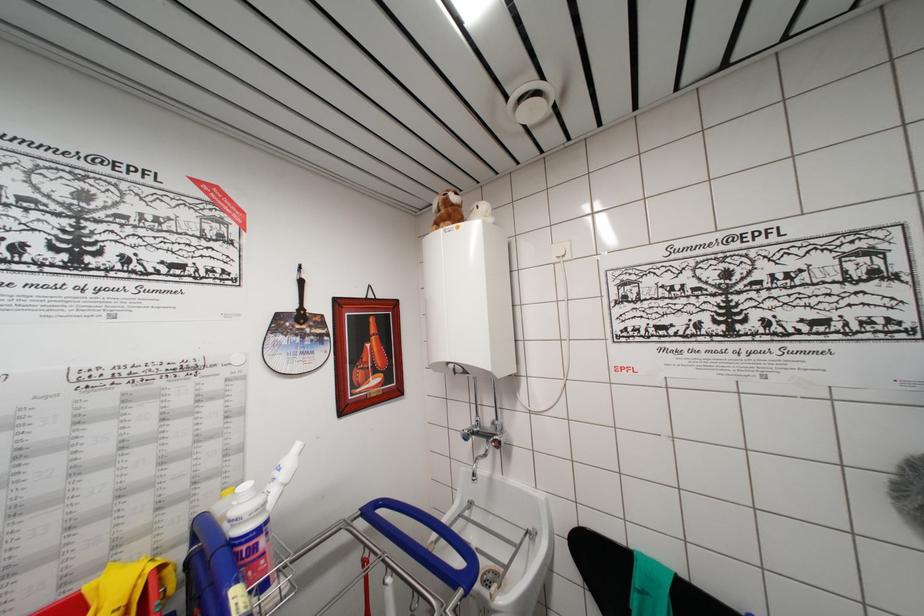
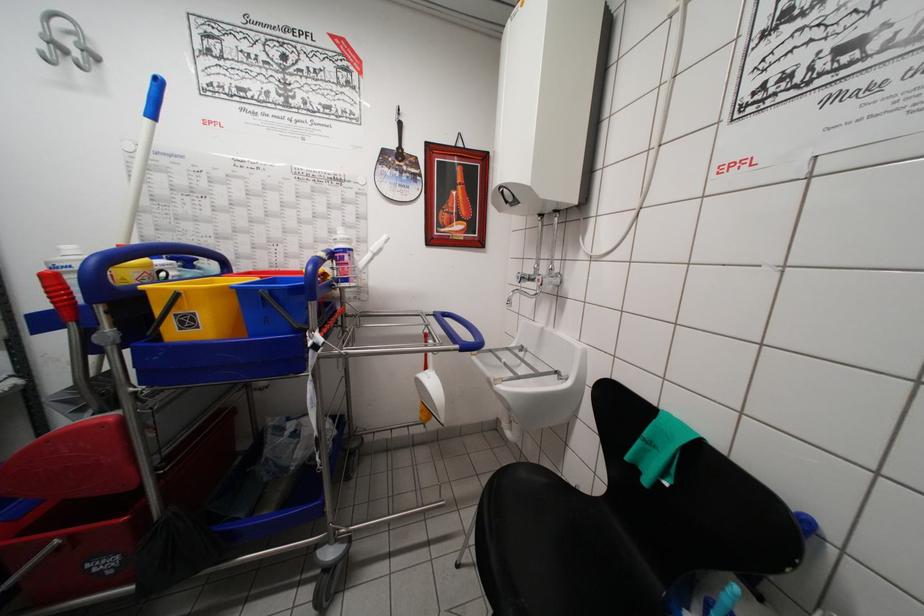
First-person continuous shooting, in which direction is the camera rotating?

The camera's rotation is toward left-down.